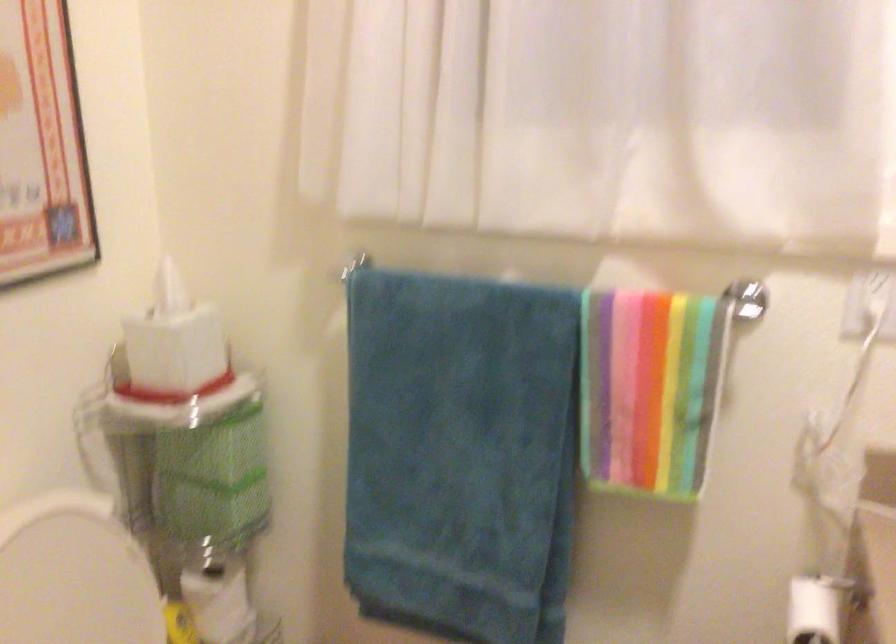
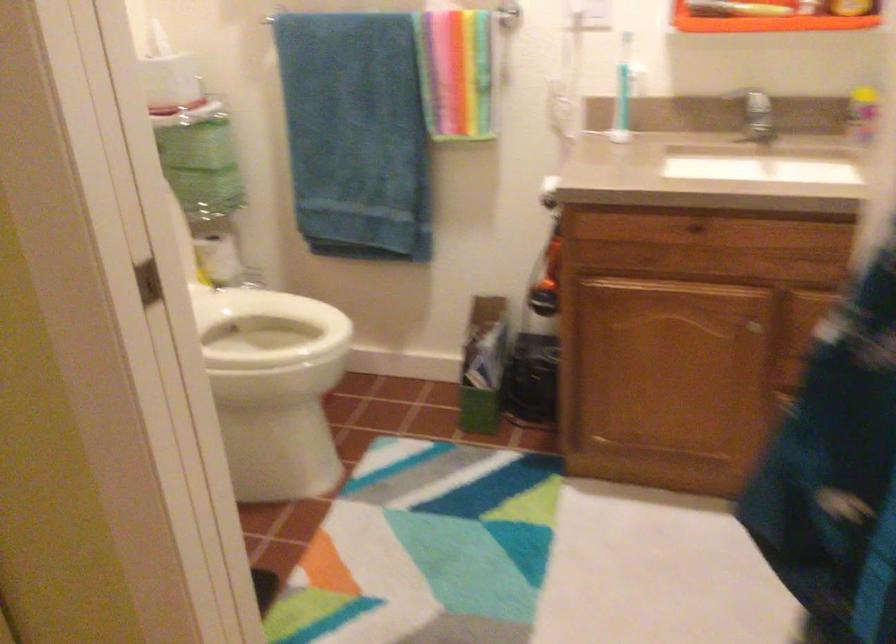
Find the pixel in the second image that matches pixel 211 450 in the first image.

(196, 145)